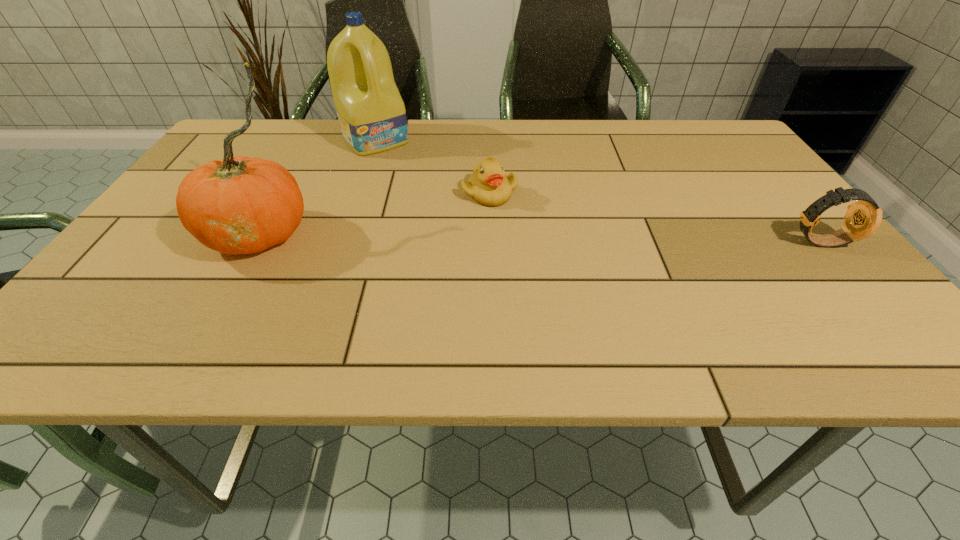
The image size is (960, 540). Identify the location of pumpkin. (239, 205).

You are a GUI agent. You are given a task and a screenshot of the screen. Output one action in this format:
    pyautogui.click(x=<x>, y=<y>)
    Task: Click on the third tallest object
    The height and width of the screenshot is (540, 960).
    Given the screenshot: What is the action you would take?
    pyautogui.click(x=863, y=218)

Where is `the rightmost object`? This screenshot has height=540, width=960. the rightmost object is located at coordinates (863, 218).

The height and width of the screenshot is (540, 960). What are the coordinates of `the farthest object` in the screenshot? It's located at (371, 113).

Identify the location of the shortest object. tap(488, 185).

I want to click on the third object from left to right, so click(x=488, y=185).

Image resolution: width=960 pixels, height=540 pixels. I want to click on vacant region located on the right of the pumpkin, so click(376, 233).

Locate an element on the screen. The width and height of the screenshot is (960, 540). free space located 0.300m on the label of the detergent is located at coordinates (441, 212).

Locate an element on the screen. vacant space located on the label of the detergent is located at coordinates (427, 197).

Identify the location of vacant space located on the label of the detergent. pos(399,166).